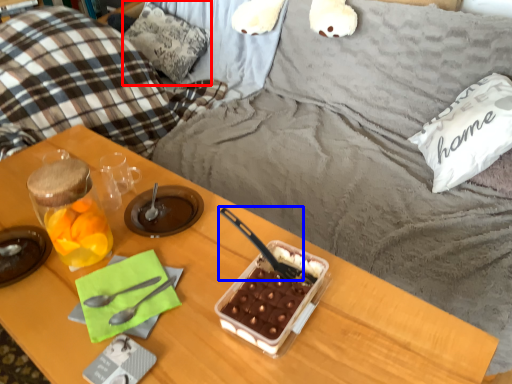
Question: Which of the following is the farthest to the observer, pillow (highlighted by a red box) or spoon (highlighted by a blue box)?

Choices:
 (A) pillow
 (B) spoon

Answer: (A)